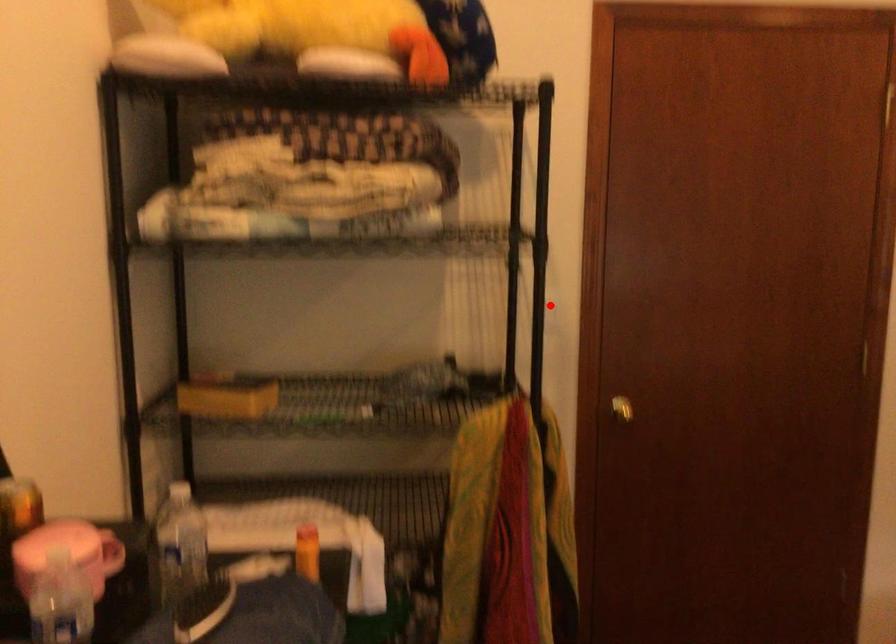
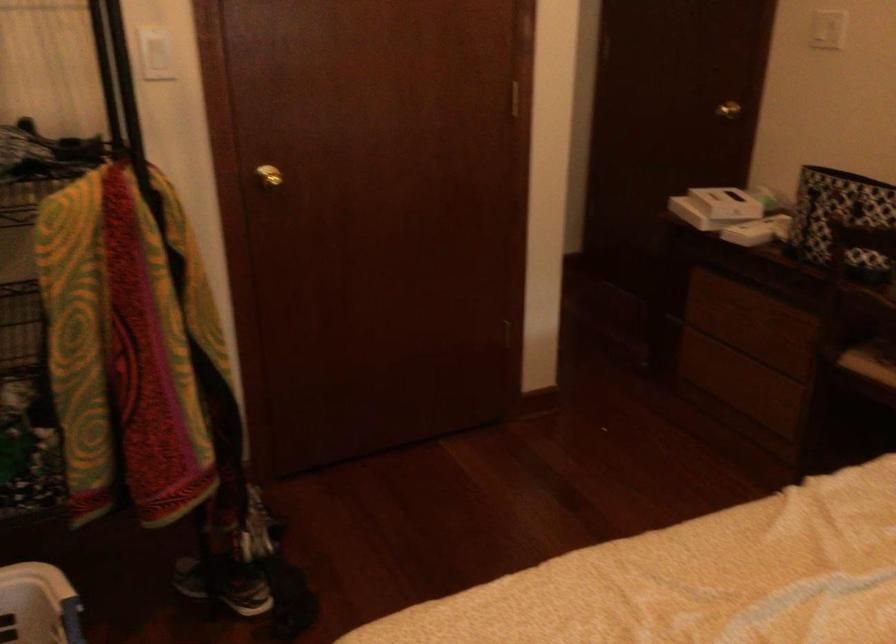
Find the pixel in the second image that matches the highlighted location in the first image.

(156, 55)